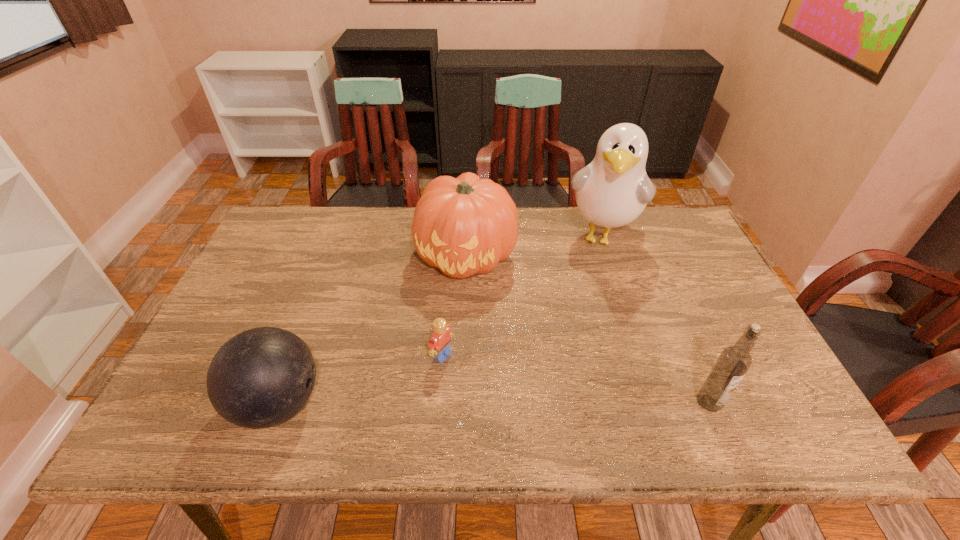
Where is `free space between the Lego and the fourth tallest object`? The image size is (960, 540). free space between the Lego and the fourth tallest object is located at coordinates (361, 380).

Find the location of a particular element. free space between the pumpkin and the vodka is located at coordinates coord(588,329).

Identify the location of empty space between the tallest object and the Lego. (521, 296).

Locate an element on the screen. Image resolution: width=960 pixels, height=540 pixels. free space between the pumpkin and the vodka is located at coordinates (588, 329).

Image resolution: width=960 pixels, height=540 pixels. Identify the location of free space that is in between the tallest object and the vodka. (655, 319).

You are a GUI agent. You are given a task and a screenshot of the screen. Output one action in this format:
    pyautogui.click(x=<x>, y=<y>)
    Task: Click on the empty space that is in between the vodka and the bowling ball
    This screenshot has width=960, height=540.
    Given the screenshot: What is the action you would take?
    pyautogui.click(x=494, y=403)

Where is `object that is the third closest one to the bowling ball`? The image size is (960, 540). object that is the third closest one to the bowling ball is located at coordinates (613, 190).

You are a GUI agent. You are given a task and a screenshot of the screen. Output one action in this format:
    pyautogui.click(x=<x>, y=<y>)
    Task: Click on the object that is the second closest one to the bowling ball
    
    Given the screenshot: What is the action you would take?
    pyautogui.click(x=466, y=225)